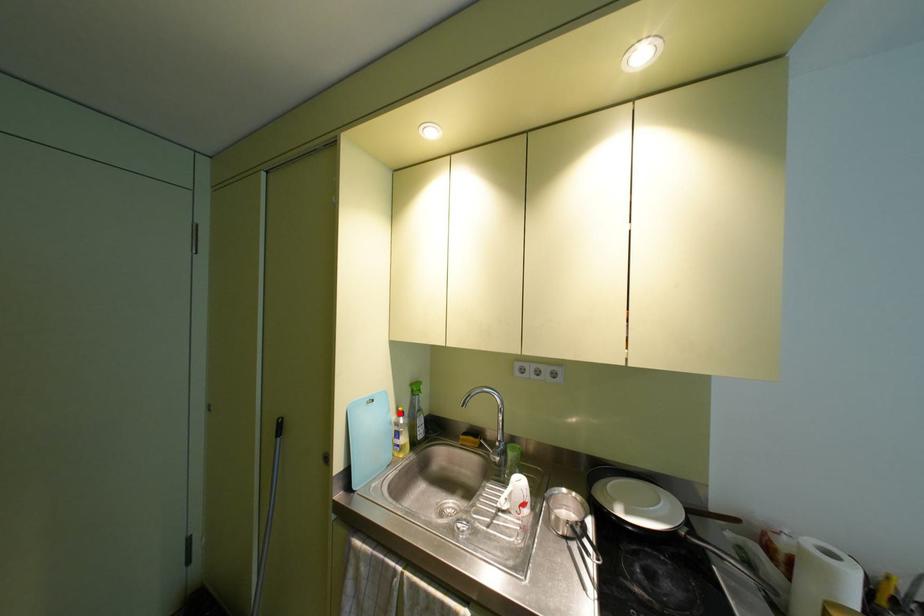
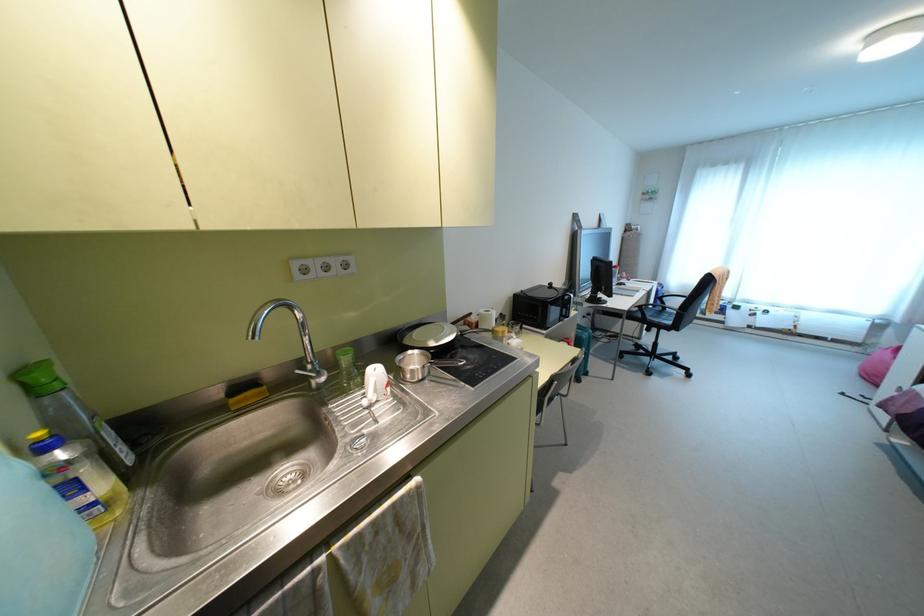
Find the pixel in the second image that matches the highlighted location in the first image.

(43, 447)